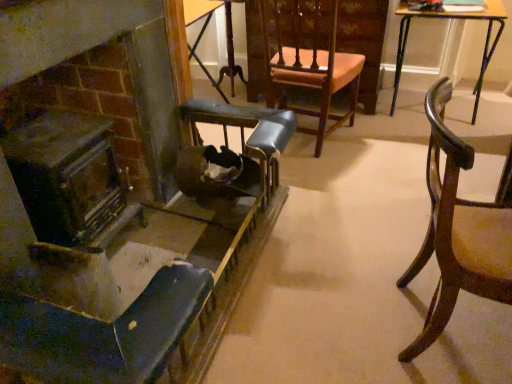
This screenshot has height=384, width=512. Find the location of `free spot in front of wooden chair with upholstered seat at center, the 2th chair positioned from the left`. free spot in front of wooden chair with upholstered seat at center, the 2th chair positioned from the left is located at coordinates (339, 176).